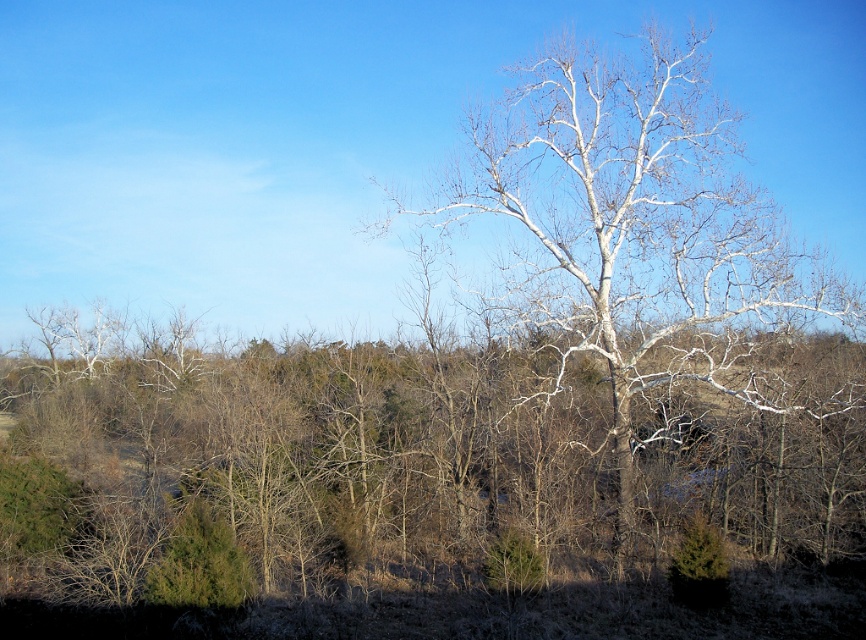
You are an artist sketching the scene and want to draw the bare branches at center and the white bark tree at center accurately. Which object should you draw first if you follow the standard left to right drawing technique?

The bare branches at center should be drawn first because they are positioned on the left side of the white bark tree at center, following the left to right drawing technique.